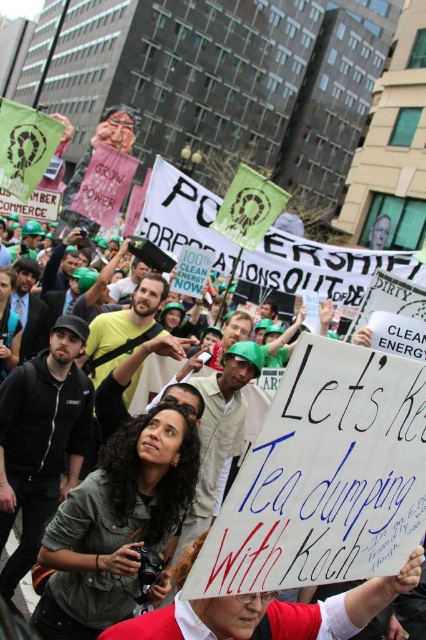
Question: Which point is closer to the camera?

Choices:
 (A) (213, 612)
 (B) (2, 312)

Answer: (A)

Question: Observing the image, what is the correct spatial positioning of matte gray shirt at center in reference to white paper sign at center?

Choices:
 (A) left
 (B) right

Answer: (A)

Question: Which object appears farthest from the camera in this image?

Choices:
 (A) matte gray shirt at center
 (B) white paper sign at center

Answer: (A)

Question: Can you confirm if matte gray shirt at center is positioned to the right of matte black jacket at center?

Choices:
 (A) no
 (B) yes

Answer: (B)

Question: Is matte gray shirt at center above matte black jacket at center?

Choices:
 (A) yes
 (B) no

Answer: (B)

Question: Estimate the real-world distances between objects in this image. Which object is farther from the matte gray shirt at center?

Choices:
 (A) white paper sign at center
 (B) matte black jacket at center

Answer: (B)